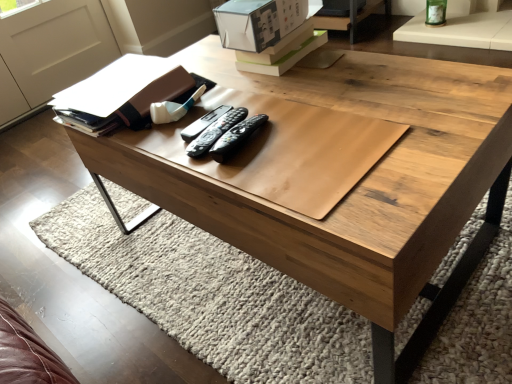
Find the location of a particular element. The height and width of the screenshot is (384, 512). free spot to the right of matte brown book at upper left is located at coordinates (243, 90).